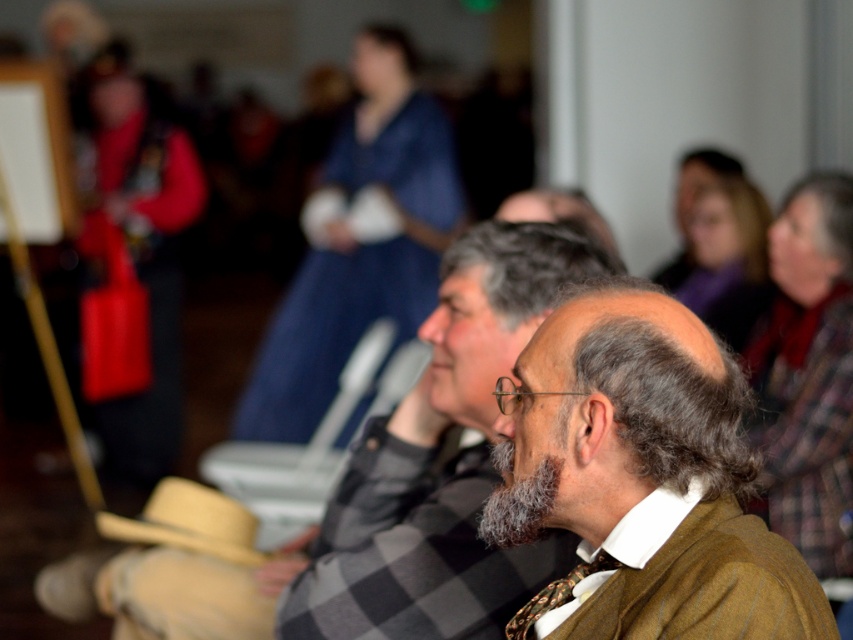
Is brown woolen coat at center smaller than gray fuzzy beard at center?

Incorrect, brown woolen coat at center is not smaller in size than gray fuzzy beard at center.

Is point (671, 509) closer to camera compared to point (489, 515)?

Yes, point (671, 509) is closer to viewer.

Find the location of a particular element. The height and width of the screenshot is (640, 853). brown woolen coat at center is located at coordinates (640, 481).

At what (x,y) coordinates should I click in order to perform the action: click on brown woolen coat at center. Please return your answer as a coordinate pair (x, y). This screenshot has height=640, width=853. Looking at the image, I should click on (640, 481).

Does gray fuzzy beard at center appear on the left side of printed silk tie at center?

Indeed, gray fuzzy beard at center is positioned on the left side of printed silk tie at center.

Is point (555, 464) farther from viewer compared to point (546, 596)?

No, (555, 464) is closer to viewer.

I want to click on gray fuzzy beard at center, so click(520, 508).

Does brown woolen coat at center appear over printed silk tie at center?

Correct, brown woolen coat at center is located above printed silk tie at center.

This screenshot has height=640, width=853. What do you see at coordinates (640, 481) in the screenshot? I see `brown woolen coat at center` at bounding box center [640, 481].

The width and height of the screenshot is (853, 640). I want to click on brown woolen coat at center, so click(x=640, y=481).